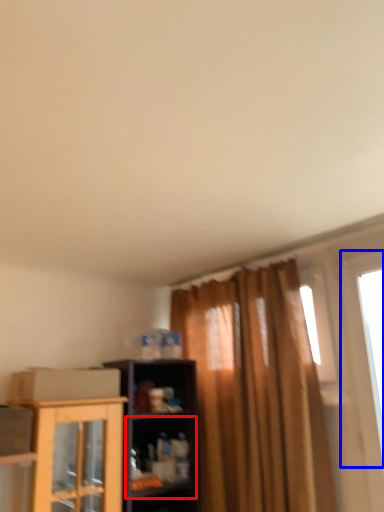
Question: Which object appears closest to the camera in this image, shelf (highlighted by a red box) or window (highlighted by a blue box)?

Choices:
 (A) shelf
 (B) window

Answer: (B)